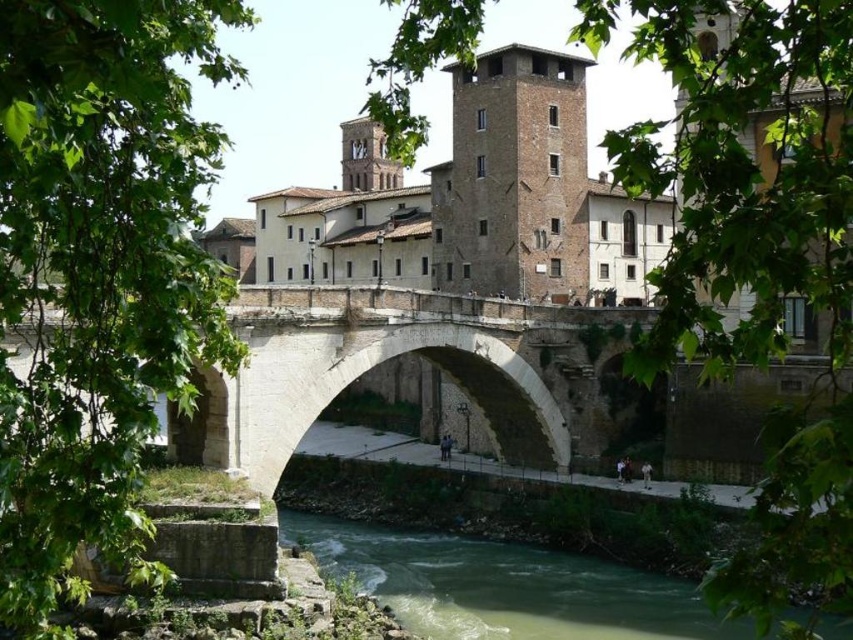
Question: Which point appears farthest from the camera in this image?

Choices:
 (A) (360, 173)
 (B) (581, 161)
 (C) (686, 588)

Answer: (A)

Question: Which point is farther to the camera?

Choices:
 (A) brown stone tower at upper center
 (B) green stone water at lower center

Answer: (A)

Question: In this image, where is brown rough stone tower at center located relative to brown stone tower at upper center?

Choices:
 (A) below
 (B) above

Answer: (A)

Question: Observing the image, what is the correct spatial positioning of brown rough stone tower at center in reference to brown stone tower at upper center?

Choices:
 (A) right
 (B) left

Answer: (A)

Question: Which of the following is the farthest from the observer?

Choices:
 (A) brown stone tower at upper center
 (B) green stone water at lower center

Answer: (A)

Question: Observing the image, what is the correct spatial positioning of brown rough stone tower at center in reference to brown stone tower at upper center?

Choices:
 (A) left
 (B) right

Answer: (B)